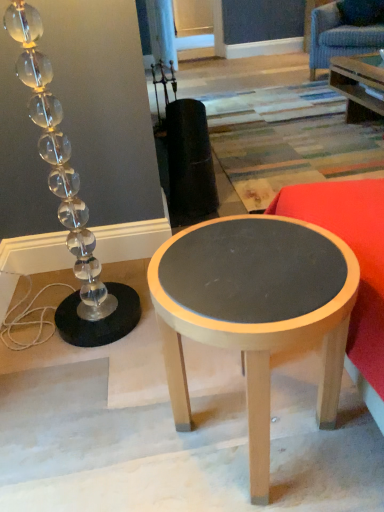
Question: Should I look upward or downward to see matte red fabric couch at right?

Choices:
 (A) down
 (B) up

Answer: (A)

Question: Is clear glass lamp at left not within blue fabric swivel chair at upper right?

Choices:
 (A) no
 (B) yes

Answer: (B)

Question: Is blue fabric swivel chair at upper right located within clear glass lamp at left?

Choices:
 (A) no
 (B) yes

Answer: (A)

Question: Considering the relative positions of clear glass lamp at left and blue fabric swivel chair at upper right in the image provided, is clear glass lamp at left in front of blue fabric swivel chair at upper right?

Choices:
 (A) yes
 (B) no

Answer: (A)

Question: Is clear glass lamp at left facing away from blue fabric swivel chair at upper right?

Choices:
 (A) yes
 (B) no

Answer: (B)

Question: From a real-world perspective, is clear glass lamp at left on top of blue fabric swivel chair at upper right?

Choices:
 (A) yes
 (B) no

Answer: (A)

Question: Does clear glass lamp at left have a lesser height compared to blue fabric swivel chair at upper right?

Choices:
 (A) no
 (B) yes

Answer: (A)

Question: Considering the relative sizes of clear glass lamp at left and matte gray wood table at center in the image provided, is clear glass lamp at left wider than matte gray wood table at center?

Choices:
 (A) no
 (B) yes

Answer: (A)

Question: Is clear glass lamp at left to the left of matte gray wood table at center from the viewer's perspective?

Choices:
 (A) no
 (B) yes

Answer: (B)

Question: From the image's perspective, is clear glass lamp at left located beneath matte gray wood table at center?

Choices:
 (A) no
 (B) yes

Answer: (A)

Question: Considering the relative sizes of clear glass lamp at left and matte gray wood table at center in the image provided, is clear glass lamp at left taller than matte gray wood table at center?

Choices:
 (A) no
 (B) yes

Answer: (B)

Question: Is clear glass lamp at left positioned with its back to matte gray wood table at center?

Choices:
 (A) no
 (B) yes

Answer: (A)

Question: Considering the relative sizes of clear glass lamp at left and matte gray wood table at center in the image provided, is clear glass lamp at left shorter than matte gray wood table at center?

Choices:
 (A) no
 (B) yes

Answer: (A)

Question: Is blue fabric swivel chair at upper right turned away from matte red fabric couch at right?

Choices:
 (A) yes
 (B) no

Answer: (B)